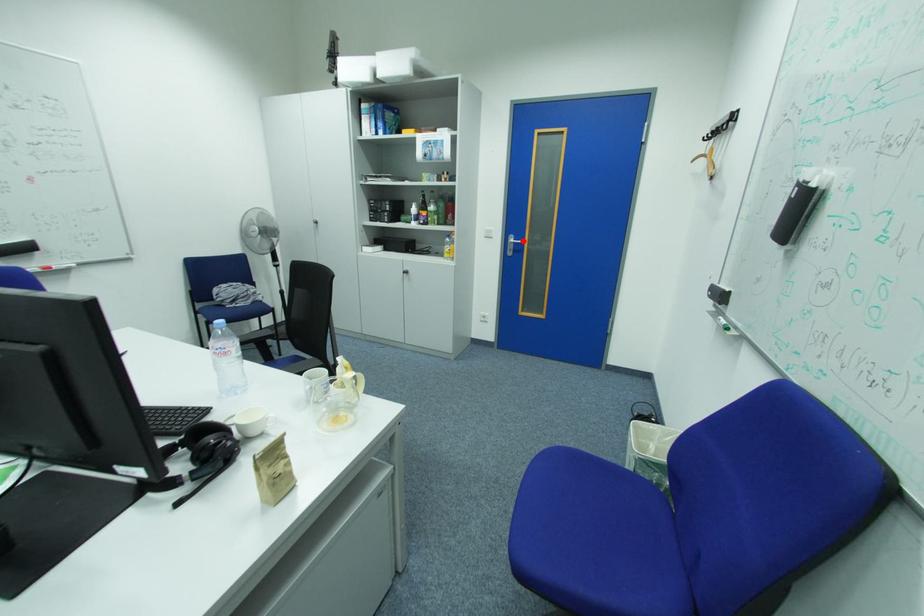
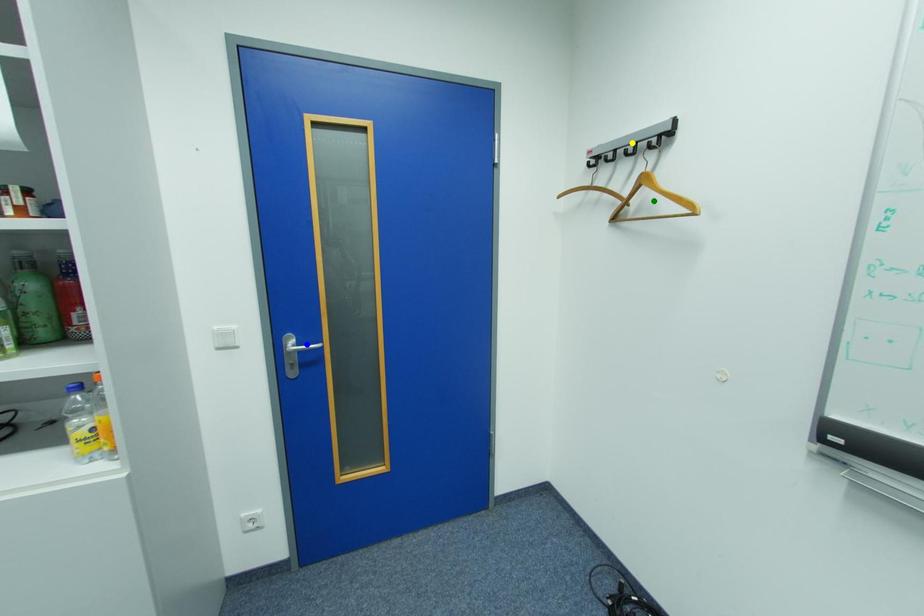
Question: I am providing you with two images of the same scene from different viewpoints. A red point is marked on the first image. You are given multiple points on the second image. Which spot in image 2 lines up with the point in image 1?

Choices:
 (A) green point
 (B) blue point
 (C) yellow point

Answer: (B)